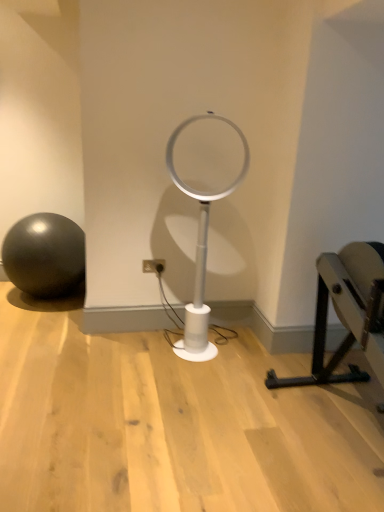
Image resolution: width=384 pixels, height=512 pixels. Identify the location of vacant area that lies between white plastic table lamp at center and black metal bench at right. (252, 394).